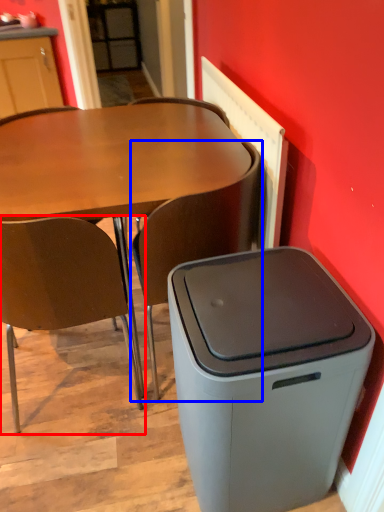
Question: Among these objects, which one is farthest to the camera, chair (highlighted by a red box) or chair (highlighted by a blue box)?

Choices:
 (A) chair
 (B) chair

Answer: (B)